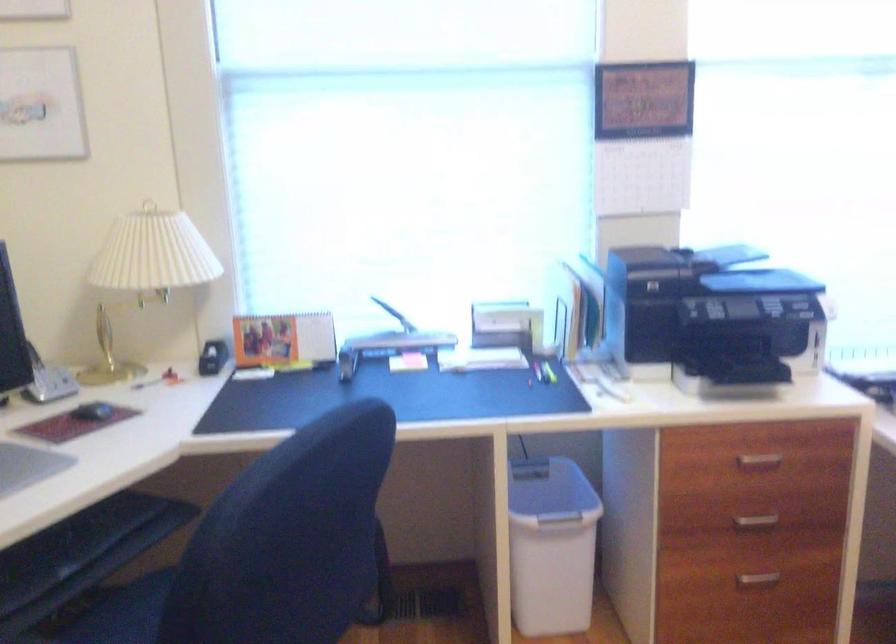
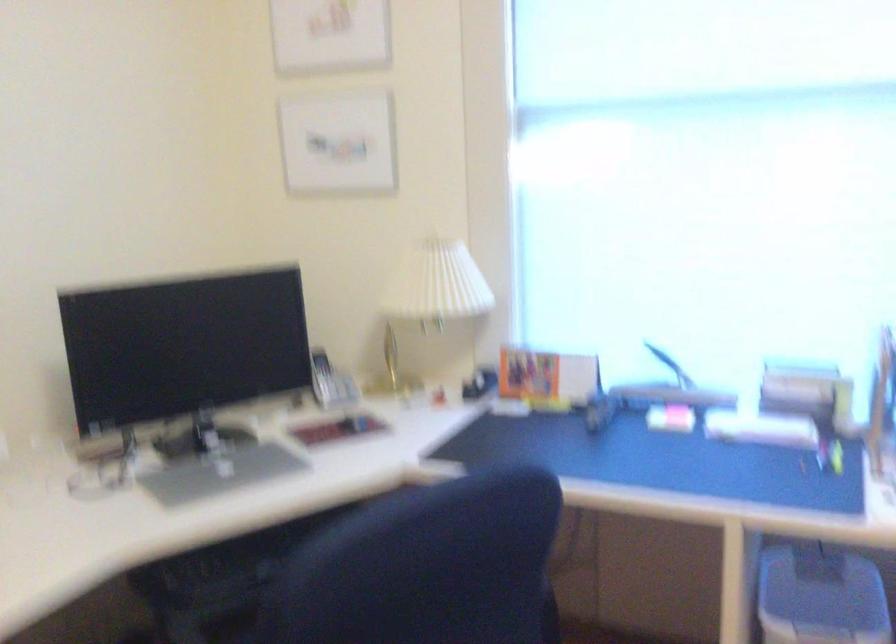
Question: The first image is from the beginning of the video and the second image is from the end. How did the camera likely rotate when shooting the video?

Choices:
 (A) Left
 (B) Right
 (C) Up
 (D) Down

Answer: (A)